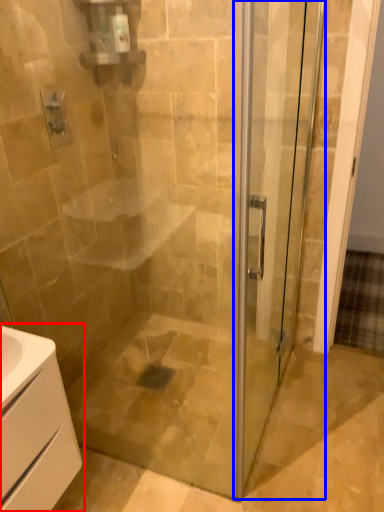
Question: Which object appears closest to the camera in this image, bathroom cabinet (highlighted by a red box) or screen door (highlighted by a blue box)?

Choices:
 (A) bathroom cabinet
 (B) screen door

Answer: (B)